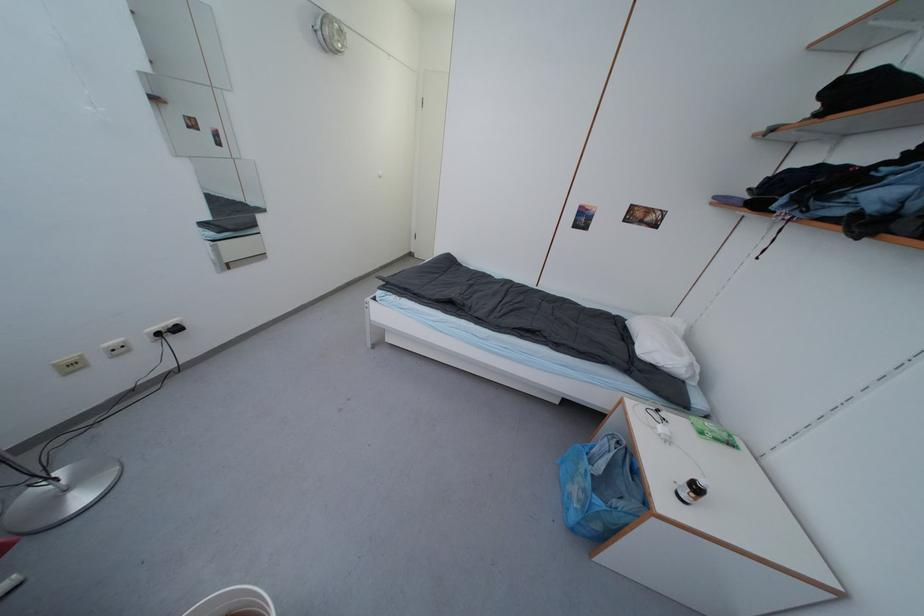
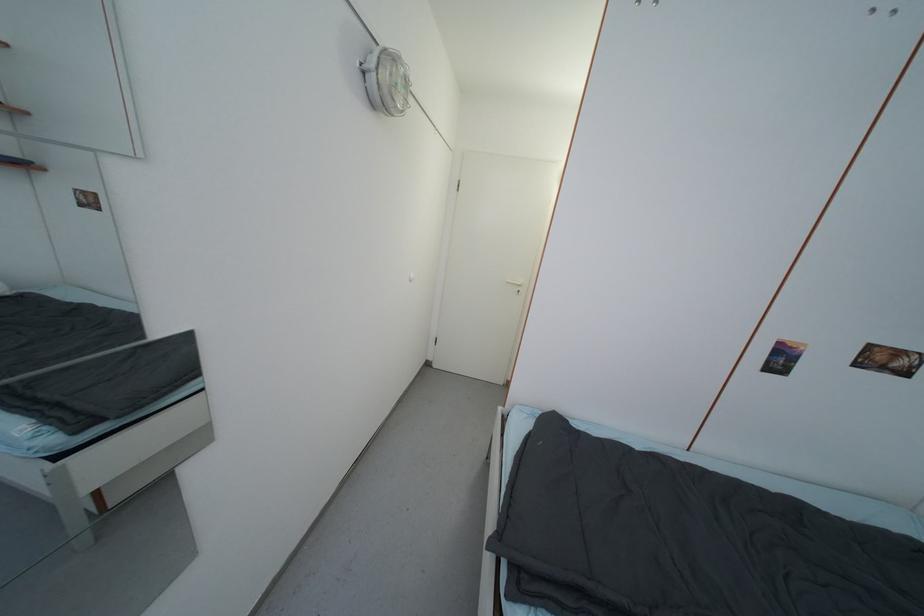
Which direction would the cameraman need to move to produce the second image?

The cameraman moved toward left, forward.